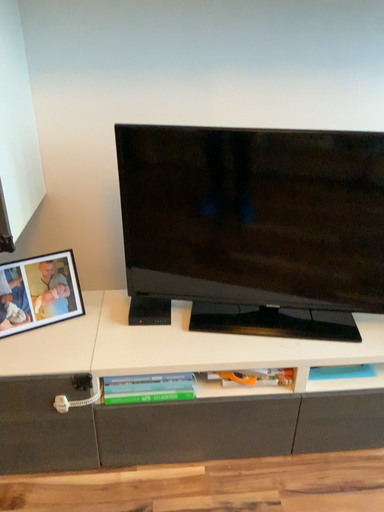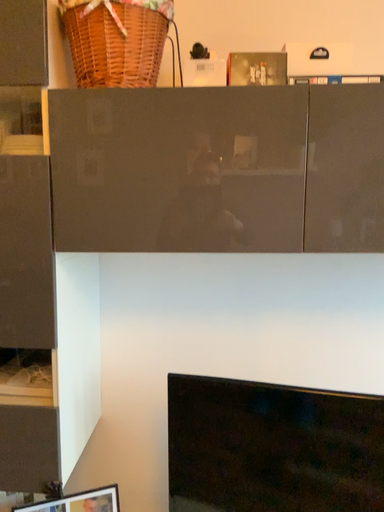
Question: Which way did the camera rotate in the video?

Choices:
 (A) rotated upward
 (B) rotated downward

Answer: (A)